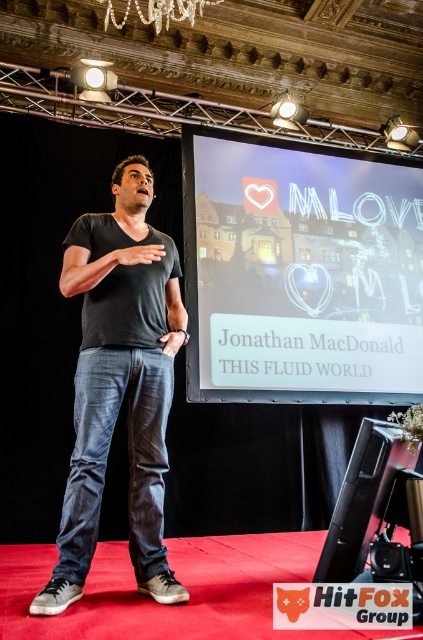
Who is more forward, (354, 380) or (184, 4)?

Positioned in front is point (184, 4).

From the picture: Is matte black screen at center behind pearl-like crystal chandelier at upper center?

Yes, it is behind pearl-like crystal chandelier at upper center.

Locate an element on the screen. matte black screen at center is located at coordinates (301, 275).

Between matte black screen at center and black matte t-shirt at center, which one appears on the left side from the viewer's perspective?

From the viewer's perspective, black matte t-shirt at center appears more on the left side.

Image resolution: width=423 pixels, height=640 pixels. I want to click on matte black screen at center, so click(x=301, y=275).

Is black matte t-shirt at center to the right of pearl-like crystal chandelier at upper center from the viewer's perspective?

In fact, black matte t-shirt at center is to the left of pearl-like crystal chandelier at upper center.

Which is more to the right, black matte t-shirt at center or pearl-like crystal chandelier at upper center?

From the viewer's perspective, pearl-like crystal chandelier at upper center appears more on the right side.

You are a GUI agent. You are given a task and a screenshot of the screen. Output one action in this format:
    pyautogui.click(x=<x>, y=<y>)
    Task: Click on the black matte t-shirt at center
    The width and height of the screenshot is (423, 640).
    Given the screenshot: What is the action you would take?
    pyautogui.click(x=120, y=384)